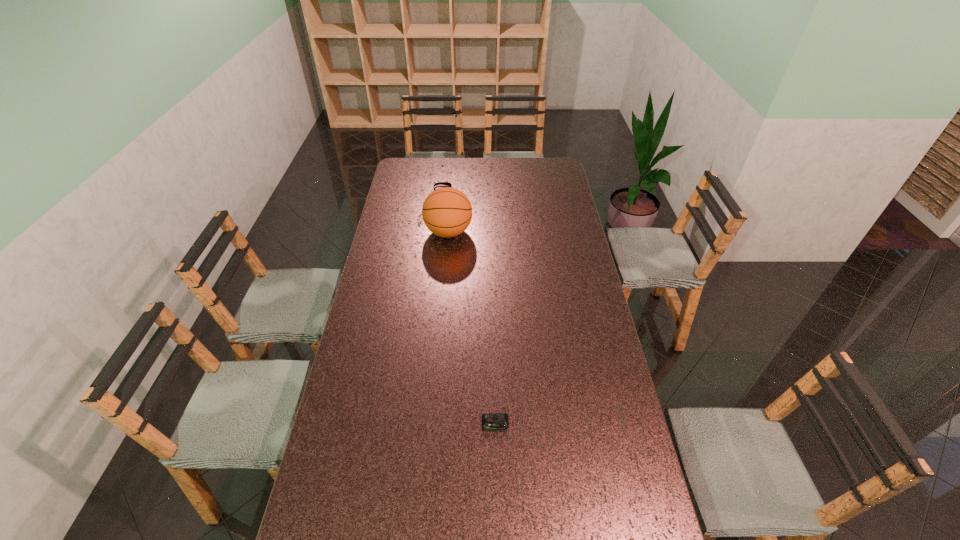
This screenshot has width=960, height=540. I want to click on vacant position in the image that satisfies the following two spatial constraints: 1. on the display of the wristband; 2. on the left side of the basketball, so click(439, 232).

Where is `free space that satisfies the following two spatial constraints: 1. on the display of the wristband; 2. on the back side of the second farthest object`? This screenshot has height=540, width=960. free space that satisfies the following two spatial constraints: 1. on the display of the wristband; 2. on the back side of the second farthest object is located at coordinates (439, 232).

Locate an element on the screen. The width and height of the screenshot is (960, 540). vacant space that satisfies the following two spatial constraints: 1. on the display of the wristband; 2. on the left side of the tallest object is located at coordinates (439, 232).

Where is `blank space that satisfies the following two spatial constraints: 1. on the display of the farthest object; 2. on the left side of the basketball`? blank space that satisfies the following two spatial constraints: 1. on the display of the farthest object; 2. on the left side of the basketball is located at coordinates (439, 232).